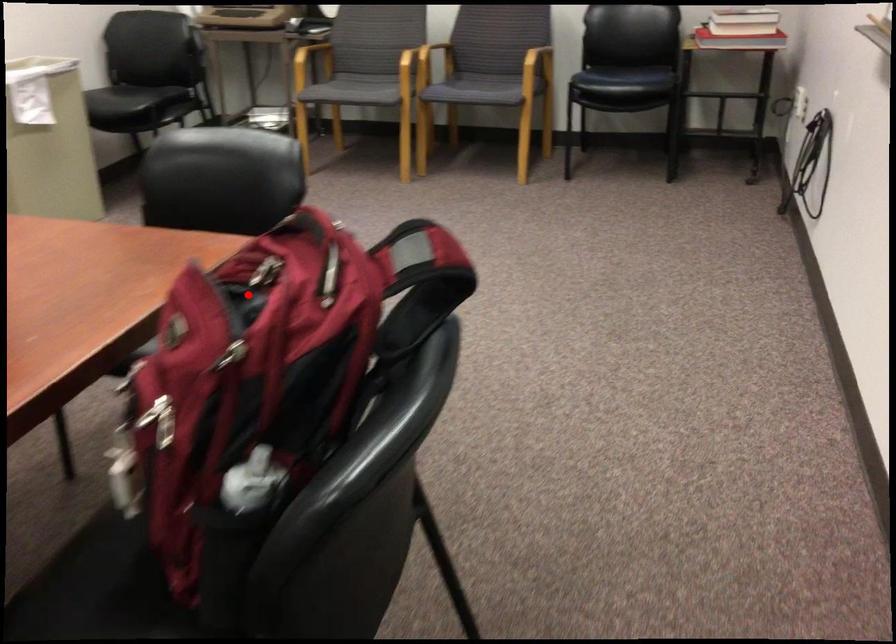
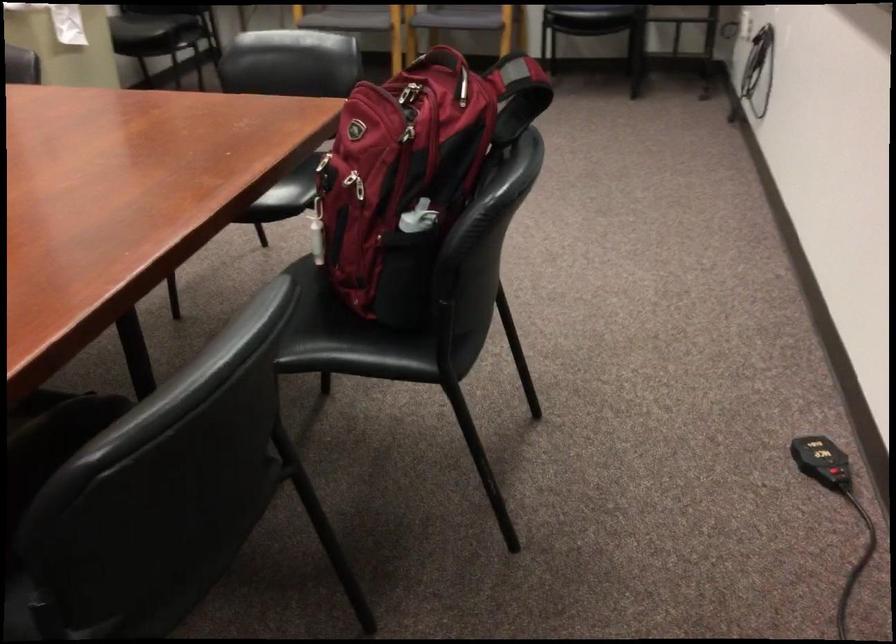
In the second image, find the point that corresponds to the highlighted location in the first image.

(408, 97)